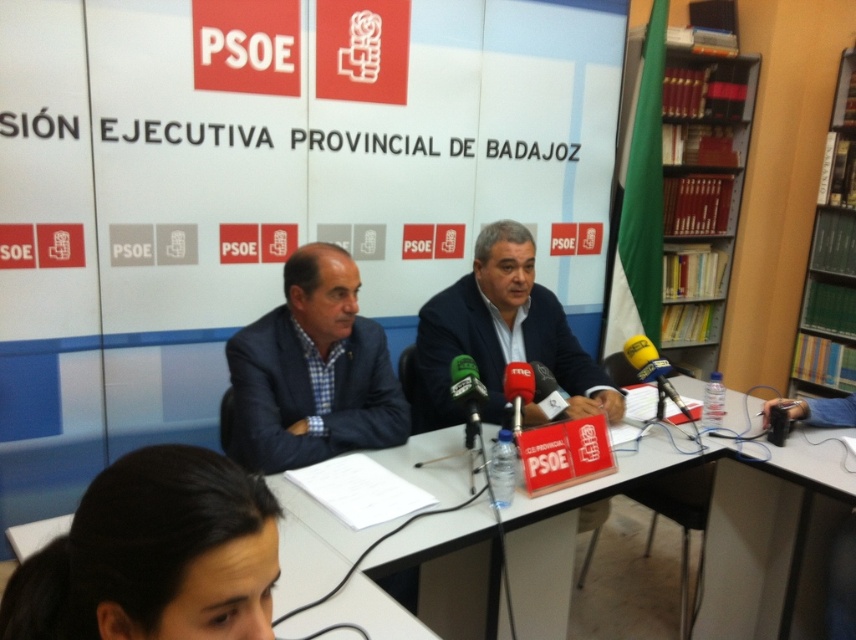
Is white plastic table at center below dark brown hair at lower left?

Yes.

Image resolution: width=856 pixels, height=640 pixels. Describe the element at coordinates (771, 536) in the screenshot. I see `white plastic table at center` at that location.

Between point (722, 621) and point (242, 502), which one is positioned in front?

Point (242, 502) is more forward.

Image resolution: width=856 pixels, height=640 pixels. Identify the location of white plastic table at center. (771, 536).

Does hardcover books at right have a lesser width compared to dark blue suit at center?

In fact, hardcover books at right might be wider than dark blue suit at center.

Describe the element at coordinates (700, 195) in the screenshot. The height and width of the screenshot is (640, 856). I see `hardcover books at right` at that location.

You are a GUI agent. You are given a task and a screenshot of the screen. Output one action in this format:
    pyautogui.click(x=<x>, y=<y>)
    Task: Click on the hardcover books at right
    Image resolution: width=856 pixels, height=640 pixels.
    Given the screenshot: What is the action you would take?
    pyautogui.click(x=700, y=195)

Is point (587, 369) positioned in front of point (518, 413)?

No.

Which is in front, point (468, 307) or point (509, 371)?

Point (509, 371) is more forward.

Find the location of a particular element. This screenshot has height=640, width=856. dark blue suit at center is located at coordinates (501, 333).